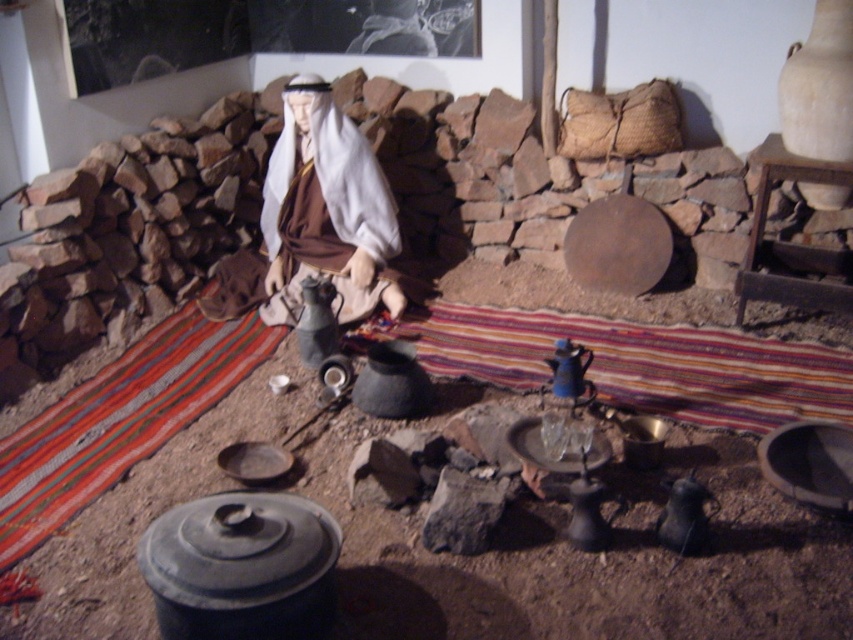
You are an archaeologist examining the items in the traditional cooking area. You notice the white matte figure at center and the blue glazed earthenware teapot at center. Which object is located to the left of the other?

The white matte figure at center is positioned on the left side of blue glazed earthenware teapot at center.

Consider the image. You are an archaeologist examining the traditional cooking area. You see the matte black pot at center and the white matte figure at center. Which object is positioned lower in the scene?

The matte black pot at center is located below the white matte figure at center, so it is positioned lower in the scene.

You are a chef preparing a dish and need to reach both the matte black pot at center and the blue glazed earthenware teapot at center. Which object is positioned lower in the scene?

The matte black pot at center is positioned below the blue glazed earthenware teapot at center, so it is lower in the scene.